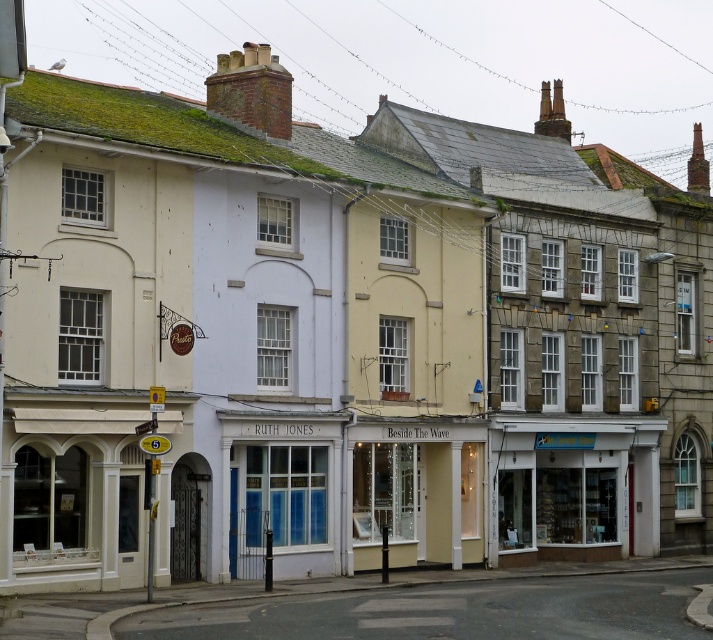
Between point (523, 531) and point (443, 534), which one is positioned behind?

The point (523, 531) is more distant.

Is white glass storefront at lower right bigger than white glass storefront at center?

Correct, white glass storefront at lower right is larger in size than white glass storefront at center.

This screenshot has width=713, height=640. In order to click on white glass storefront at lower right in this screenshot , I will do `click(575, 481)`.

You are a GUI agent. You are given a task and a screenshot of the screen. Output one action in this format:
    pyautogui.click(x=<x>, y=<y>)
    Task: Click on the white glass storefront at lower right
    The height and width of the screenshot is (640, 713).
    Given the screenshot: What is the action you would take?
    pyautogui.click(x=575, y=481)